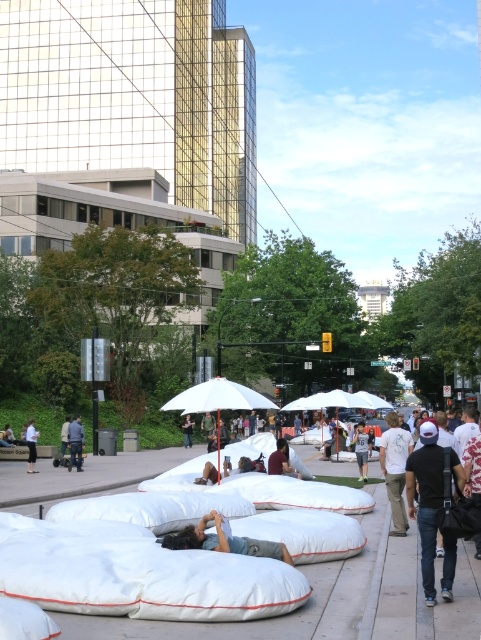
Looking at this image, you are standing in the city park and see a white cotton shirt at center and a denim jacket at center. Which one is nearer to you?

The white cotton shirt at center is closer to the viewer than the denim jacket at center.

You are a photographer wanting to capture both the matte black cap at center and the blue denim jeans at center in a single frame. Since the cap is in front of the jeans, how should you adjust your camera position to ensure both are visible without one blocking the other?

The matte black cap at center is in front of the blue denim jeans at center. To capture both without obstruction, position the camera slightly above the cap so the jeans become visible behind it.